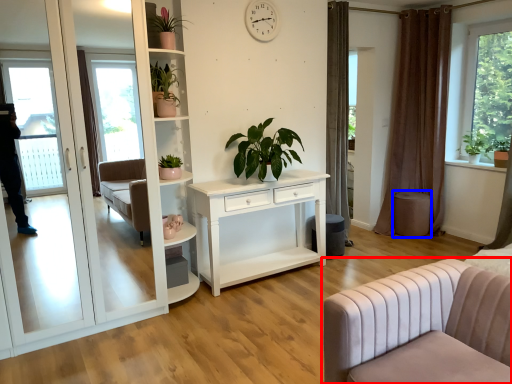
Question: Which object appears farthest to the camera in this image, studio couch (highlighted by a red box) or stool (highlighted by a blue box)?

Choices:
 (A) studio couch
 (B) stool

Answer: (B)